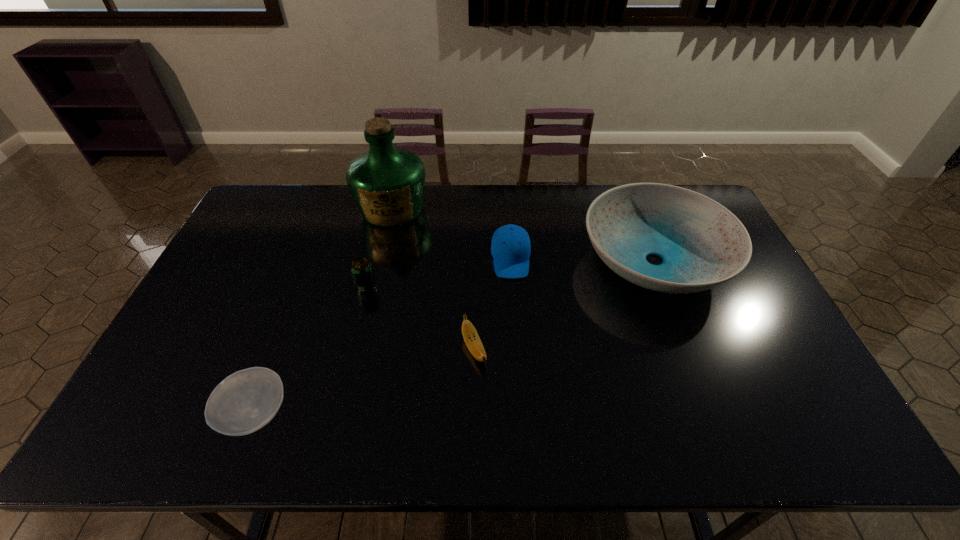
The image size is (960, 540). What are the coordinates of `free space located 0.100m on the back of the beer can` in the screenshot? It's located at (373, 256).

This screenshot has height=540, width=960. Identify the location of vacant region located on the front-facing side of the cap. (516, 322).

The height and width of the screenshot is (540, 960). In order to click on vacant space located on the back of the second nearest object in this screenshot , I will do `click(475, 240)`.

The image size is (960, 540). I want to click on vacant area located 0.140m on the right of the bowl, so click(x=350, y=414).

The height and width of the screenshot is (540, 960). Find the location of `liquor that is at the far edge`. liquor that is at the far edge is located at coordinates point(387,183).

Find the location of a particular element. The image size is (960, 540). dish that is at the far edge is located at coordinates (702, 244).

Find the location of `object at the near edge`. object at the near edge is located at coordinates (245, 401).

Identify the location of object that is at the right edge. (702, 244).

Identify the location of object at the far right corner. The height and width of the screenshot is (540, 960). (702, 244).

The image size is (960, 540). What are the coordinates of `free space at the far edge of the desktop` in the screenshot? It's located at (348, 191).